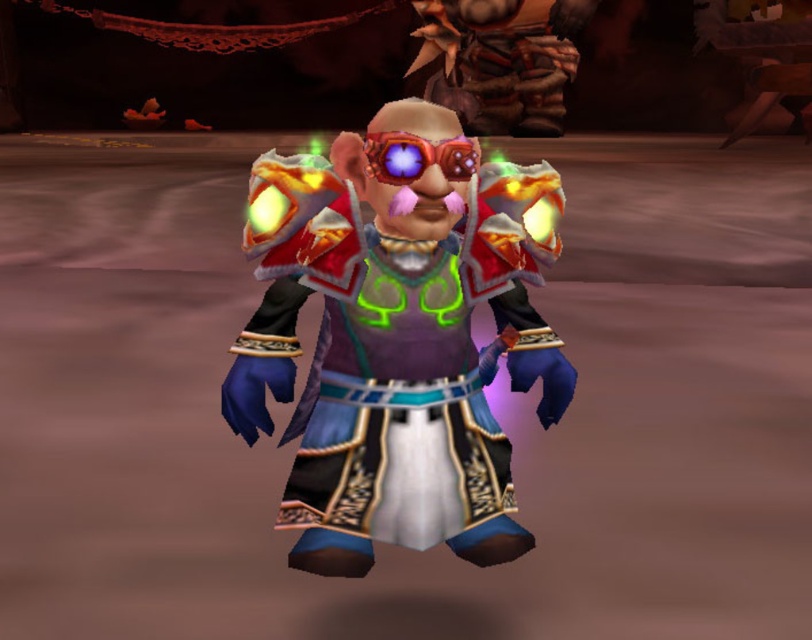
Who is taller, shiny metallic armor at center or translucent red goggles at center?

shiny metallic armor at center

Is shiny metallic armor at center shorter than translucent red goggles at center?

Incorrect, shiny metallic armor at center's height does not fall short of translucent red goggles at center's.

Describe the element at coordinates (395, 349) in the screenshot. I see `shiny metallic armor at center` at that location.

Find the location of a particular element. Image resolution: width=812 pixels, height=640 pixels. shiny metallic armor at center is located at coordinates (395, 349).